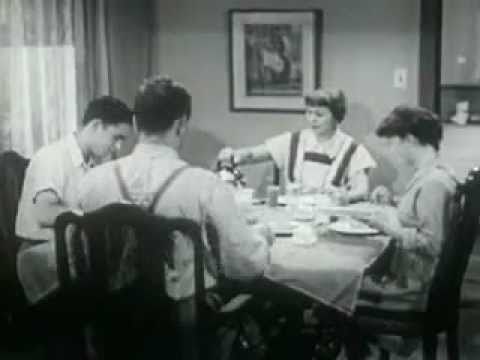
The image size is (480, 360). Find the location of `curtain`. curtain is located at coordinates (23, 103), (68, 20), (70, 70), (93, 46), (101, 17).